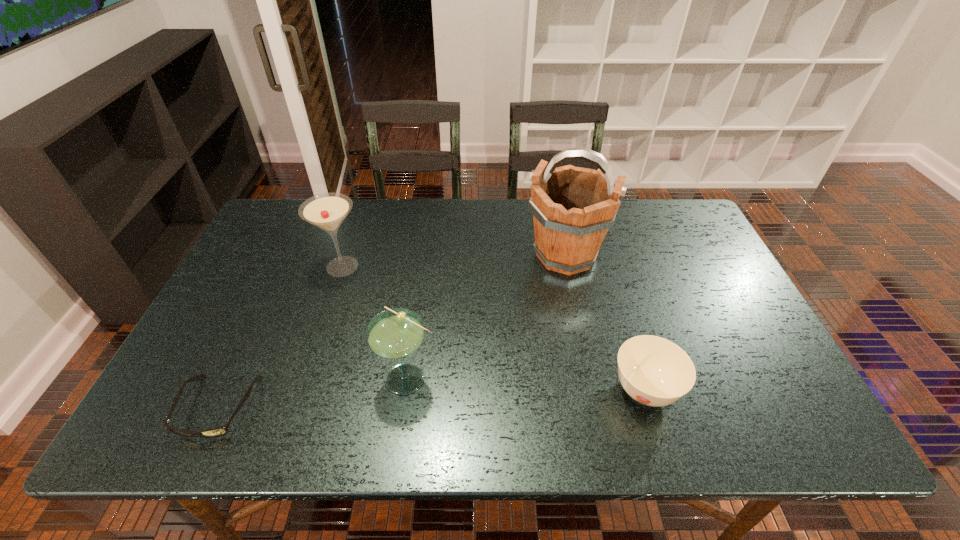
Image resolution: width=960 pixels, height=540 pixels. Find the location of `free spot between the fourth tallest object and the third shortest object`. free spot between the fourth tallest object and the third shortest object is located at coordinates (527, 384).

Where is `object that is the third closest one to the right martini`? This screenshot has width=960, height=540. object that is the third closest one to the right martini is located at coordinates (573, 207).

Select which object appears as the closest to the bucket. Please provide its 2D coordinates. Your answer should be formatted as a tuple, i.e. [(x, y)], where the tuple contains the x and y coordinates of a point satisfying the conditions above.

[(654, 371)]

What are the coordinates of `free space that satisfies the following two spatial constraints: 1. on the front side of the third shortest object; 2. on the left side of the second tallest object` in the screenshot? It's located at (306, 378).

Find the location of a particular element. This screenshot has width=960, height=540. free location that satisfies the following two spatial constraints: 1. on the front side of the second shortest object; 2. on the right side of the nearer martini is located at coordinates (408, 390).

Locate an element on the screen. The width and height of the screenshot is (960, 540). free location that satisfies the following two spatial constraints: 1. on the front side of the bucket; 2. on the left side of the sugar bowl is located at coordinates (593, 390).

Where is `vacant area that satisfies the following two spatial constraints: 1. on the back side of the third shortest object; 2. on the right side of the bucket`? Image resolution: width=960 pixels, height=540 pixels. vacant area that satisfies the following two spatial constraints: 1. on the back side of the third shortest object; 2. on the right side of the bucket is located at coordinates (425, 255).

Find the location of a particular element. This screenshot has width=960, height=540. vacant area in the image that satisfies the following two spatial constraints: 1. on the front side of the taller martini; 2. on the right side of the sugar bowl is located at coordinates (301, 390).

At what (x,y) coordinates should I click in order to perform the action: click on vacant position in the image that satisfies the following two spatial constraints: 1. on the front side of the nearer martini; 2. on the right side of the taller martini. Please return your answer as a coordinate pair (x, y). Image resolution: width=960 pixels, height=540 pixels. Looking at the image, I should click on (306, 378).